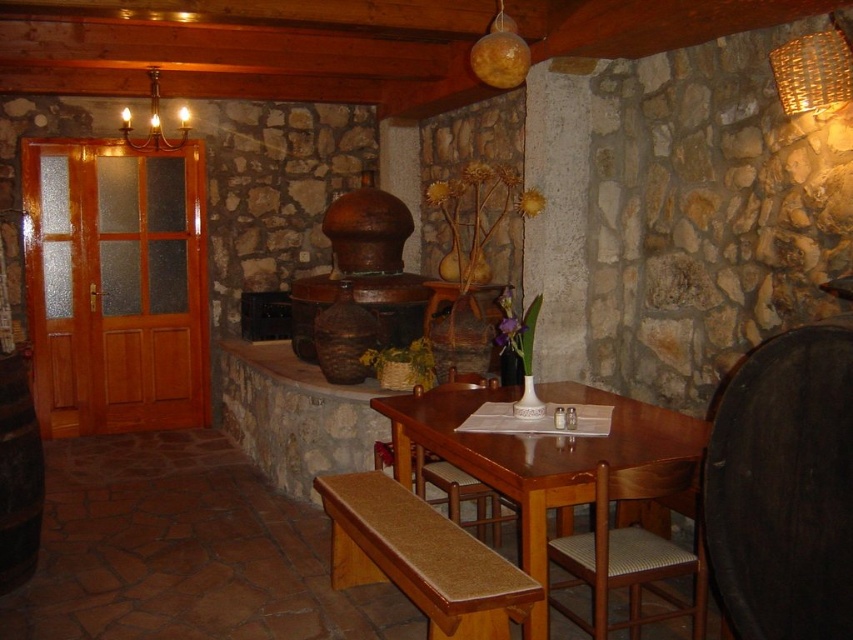
Question: Observing the image, what is the correct spatial positioning of wooden chair at center in reference to wooden chandelier at upper left?

Choices:
 (A) above
 (B) below

Answer: (B)

Question: Among these objects, which one is nearest to the camera?

Choices:
 (A) wooden chair with woven seat at lower right
 (B) matte orange sphere at upper center
 (C) wooden chandelier at upper left
 (D) woven wicker basket at upper right

Answer: (A)

Question: Considering the relative positions of wooden table at center and wooden chair at center in the image provided, where is wooden table at center located with respect to wooden chair at center?

Choices:
 (A) left
 (B) right

Answer: (B)

Question: Among these objects, which one is farthest from the camera?

Choices:
 (A) wooden chair with woven seat at lower right
 (B) wooden chair at center

Answer: (B)

Question: Can you confirm if brown textured bench at lower center is positioned to the left of wooden chandelier at upper left?

Choices:
 (A) yes
 (B) no

Answer: (B)

Question: Which of the following is the closest to the observer?

Choices:
 (A) brown textured bench at lower center
 (B) woven wicker basket at upper right
 (C) wooden table at center
 (D) wooden chair with woven seat at lower right

Answer: (A)